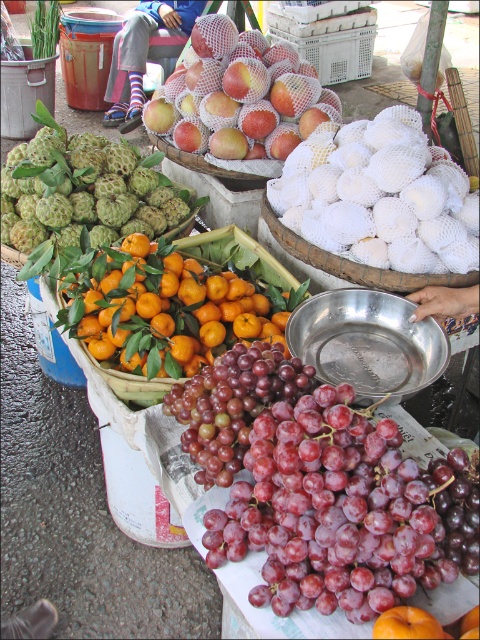
Does shiny purple grapes at center lie in front of purple matte grapes at center?

Yes, shiny purple grapes at center is in front of purple matte grapes at center.

Is point (389, 502) farther from camera compared to point (245, 368)?

No, it is in front of (245, 368).

Does point (367, 612) come closer to viewer compared to point (230, 429)?

Yes.

At what (x,y) coordinates should I click in order to perform the action: click on shiny purple grapes at center. Please return your answer as a coordinate pair (x, y). The height and width of the screenshot is (640, 480). Looking at the image, I should click on pyautogui.click(x=333, y=512).

Describe the element at coordinates (172, 308) in the screenshot. The height and width of the screenshot is (640, 480). I see `orange matte tangerines at center` at that location.

Is orange matte tangerines at center further to camera compared to white mesh basket at center?

No, it is not.

The height and width of the screenshot is (640, 480). Find the location of `orange matte tangerines at center`. orange matte tangerines at center is located at coordinates (172, 308).

Can you confirm if red matte apples at center is positioned to the left of purple matte grapes at center?

Correct, you'll find red matte apples at center to the left of purple matte grapes at center.

Identify the location of red matte apples at center. (232, 90).